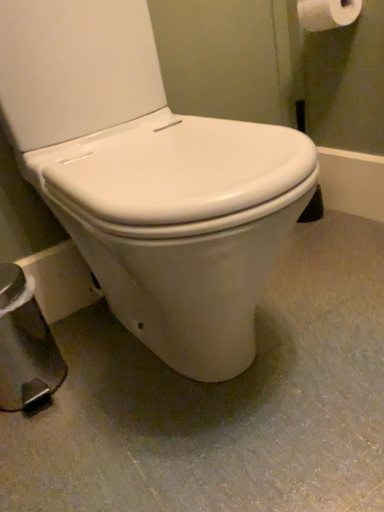
Question: Is white smooth toilet at center closer to camera compared to white matte toilet paper at upper right?

Choices:
 (A) no
 (B) yes

Answer: (B)

Question: From the image's perspective, would you say white smooth toilet at center is shown under white matte toilet paper at upper right?

Choices:
 (A) yes
 (B) no

Answer: (A)

Question: Is white smooth toilet at center bigger than white matte toilet paper at upper right?

Choices:
 (A) yes
 (B) no

Answer: (A)

Question: Is white matte toilet paper at upper right inside white smooth toilet at center?

Choices:
 (A) no
 (B) yes

Answer: (A)

Question: Is white smooth toilet at center oriented towards white matte toilet paper at upper right?

Choices:
 (A) yes
 (B) no

Answer: (B)

Question: Can you confirm if white smooth toilet at center is thinner than white matte toilet paper at upper right?

Choices:
 (A) no
 (B) yes

Answer: (A)

Question: From a real-world perspective, is white matte toilet paper at upper right beneath white glossy toilet at center?

Choices:
 (A) yes
 (B) no

Answer: (B)

Question: From the image's perspective, does white matte toilet paper at upper right appear lower than white glossy toilet at center?

Choices:
 (A) yes
 (B) no

Answer: (B)

Question: Are white matte toilet paper at upper right and white glossy toilet at center located far from each other?

Choices:
 (A) no
 (B) yes

Answer: (A)

Question: Considering the relative sizes of white matte toilet paper at upper right and white glossy toilet at center in the image provided, is white matte toilet paper at upper right smaller than white glossy toilet at center?

Choices:
 (A) yes
 (B) no

Answer: (A)

Question: Does white matte toilet paper at upper right have a lesser height compared to white glossy toilet at center?

Choices:
 (A) yes
 (B) no

Answer: (A)

Question: Is white matte toilet paper at upper right wider than white glossy toilet at center?

Choices:
 (A) no
 (B) yes

Answer: (A)

Question: Is white glossy toilet at center touching white smooth toilet at center?

Choices:
 (A) yes
 (B) no

Answer: (B)